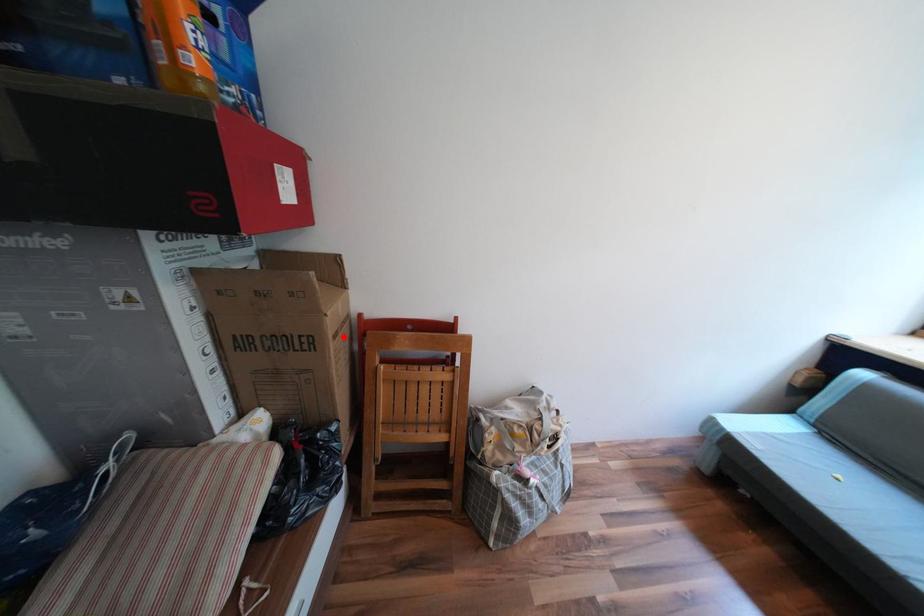
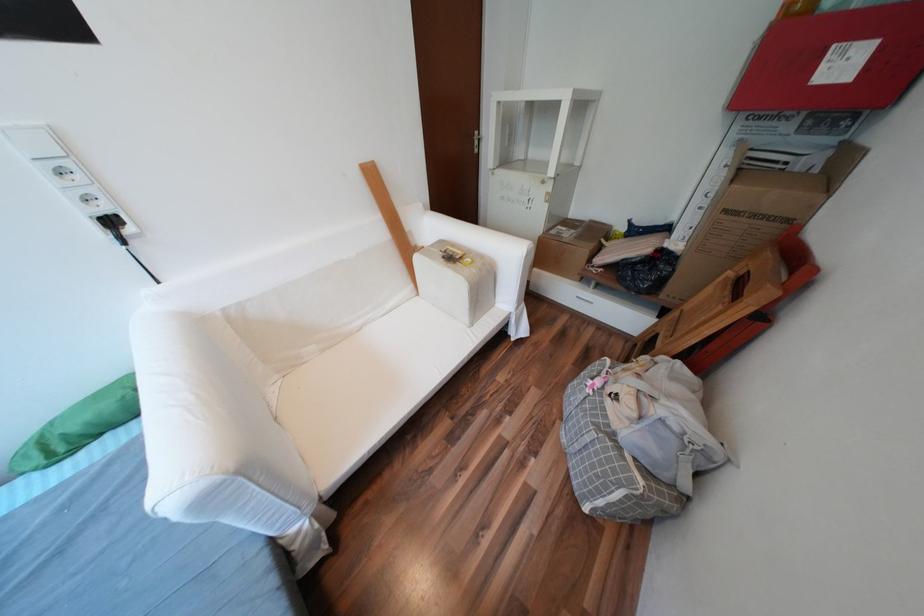
The point at the highlighted location is marked in the first image. Where is the corresponding point in the second image?

(736, 211)